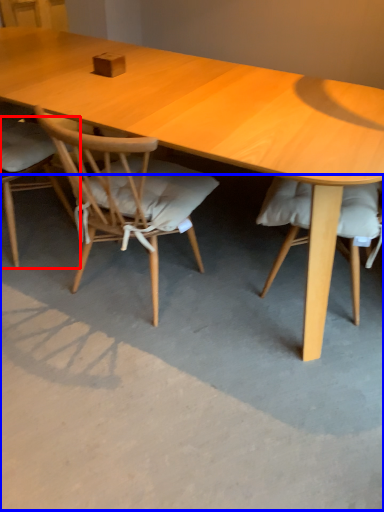
Question: Among these objects, which one is nearest to the camera, chair (highlighted by a red box) or concrete (highlighted by a blue box)?

Choices:
 (A) chair
 (B) concrete

Answer: (B)